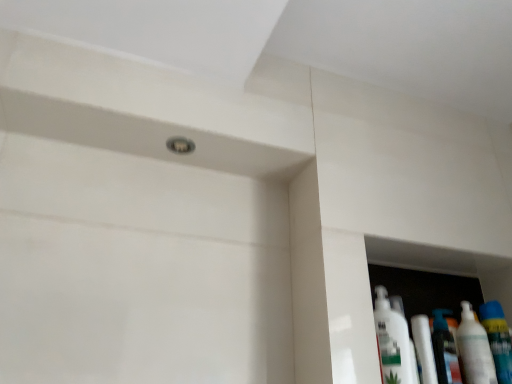
Question: From the image's perspective, is white glossy bottle at lower right, which appears as the 1th cleaning product when viewed from the left, located beneath white glossy bottle at right, the 2th cleaning product viewed from the left?

Choices:
 (A) yes
 (B) no

Answer: (B)

Question: Considering the relative sizes of white glossy bottle at lower right, which appears as the 1th cleaning product when viewed from the left, and white glossy bottle at right, the 2th cleaning product viewed from the left, in the image provided, is white glossy bottle at lower right, which appears as the 1th cleaning product when viewed from the left, smaller than white glossy bottle at right, the 2th cleaning product viewed from the left,?

Choices:
 (A) yes
 (B) no

Answer: (B)

Question: Can you confirm if white glossy bottle at lower right, acting as the 2th cleaning product starting from the right, is bigger than white glossy bottle at right, the 2th cleaning product viewed from the left?

Choices:
 (A) no
 (B) yes

Answer: (B)

Question: Is the position of white glossy bottle at lower right, which appears as the 1th cleaning product when viewed from the left, more distant than that of white glossy bottle at right, the 2th cleaning product viewed from the left?

Choices:
 (A) yes
 (B) no

Answer: (B)

Question: Considering the relative sizes of white glossy bottle at lower right, acting as the 2th cleaning product starting from the right, and white glossy bottle at right, the 1th cleaning product when ordered from right to left, in the image provided, is white glossy bottle at lower right, acting as the 2th cleaning product starting from the right, taller than white glossy bottle at right, the 1th cleaning product when ordered from right to left,?

Choices:
 (A) yes
 (B) no

Answer: (A)

Question: Is white glossy bottle at lower right, which appears as the 1th cleaning product when viewed from the left, not within white glossy bottle at right, the 2th cleaning product viewed from the left?

Choices:
 (A) yes
 (B) no

Answer: (A)

Question: From the image's perspective, is white glossy bottle at right, acting as the second mouthwash starting from the right, located above white glossy bottle at lower right, acting as the 2th cleaning product starting from the right?

Choices:
 (A) no
 (B) yes

Answer: (A)

Question: Is the depth of white glossy bottle at right, which is the first mouthwash in left-to-right order, less than that of white glossy bottle at lower right, which appears as the 1th cleaning product when viewed from the left?

Choices:
 (A) no
 (B) yes

Answer: (A)

Question: Considering the relative sizes of white glossy bottle at right, acting as the second mouthwash starting from the right, and white glossy bottle at lower right, which appears as the 1th cleaning product when viewed from the left, in the image provided, is white glossy bottle at right, acting as the second mouthwash starting from the right, shorter than white glossy bottle at lower right, which appears as the 1th cleaning product when viewed from the left,?

Choices:
 (A) yes
 (B) no

Answer: (A)

Question: Does white glossy bottle at right, acting as the second mouthwash starting from the right, have a greater height compared to white glossy bottle at lower right, acting as the 2th cleaning product starting from the right?

Choices:
 (A) no
 (B) yes

Answer: (A)

Question: Is white glossy bottle at right, acting as the second mouthwash starting from the right, located outside white glossy bottle at lower right, which appears as the 1th cleaning product when viewed from the left?

Choices:
 (A) no
 (B) yes

Answer: (B)

Question: Considering the relative sizes of white glossy bottle at right, acting as the second mouthwash starting from the right, and white glossy bottle at lower right, acting as the 2th cleaning product starting from the right, in the image provided, is white glossy bottle at right, acting as the second mouthwash starting from the right, wider than white glossy bottle at lower right, acting as the 2th cleaning product starting from the right,?

Choices:
 (A) no
 (B) yes

Answer: (A)

Question: Does white glossy tube at lower right appear on the left side of white glossy bottle at right, the 1th cleaning product when ordered from right to left?

Choices:
 (A) yes
 (B) no

Answer: (A)